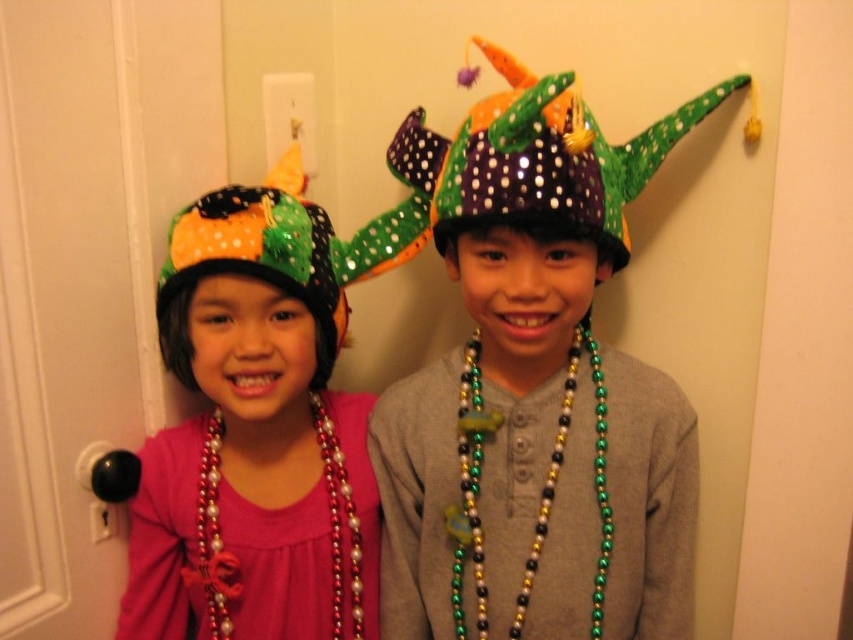
You are a photographer trying to capture both the shiny sequined hat at left and the metallic beads necklace at center in a single frame. Since you can only focus on one object at a time, which object should you focus on to ensure the other is still in the frame?

You should focus on the shiny sequined hat at left because it is to the left of the metallic beads necklace at center, so keeping the hat in focus will naturally include the necklace in the frame as well.

You are a photographer standing at a certain distance from the children. You want to take a closeup photo of the point at coordinates point (245, 289). If your camera can focus on objects within 30 inches, will you be able to capture the point clearly?

The distance of point (245, 289) from camera is 35.38 inches, which is beyond the camera focus range of 30 inches. Therefore, the point cannot be captured clearly.

You are a photographer trying to capture a closeup of the necklace of the child on the left. You are currently positioned at point A which is at coordinates point (601, 513). There is an obstacle at point B which is at coordinates point (299, 262). Will you be able to take the photo without moving your position?

Point (601, 513) is further to the viewer than point (299, 262), so the obstacle at point (299, 262) is closer to you. Therefore, you will not be able to take the photo without moving your position because the obstacle is blocking the view.